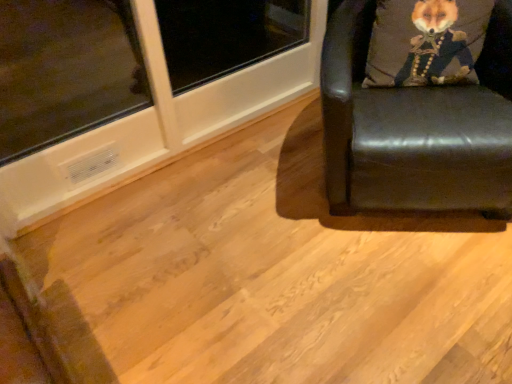
What is the approximate height of velvet fox head at upper right?

It is 13.40 inches.

In order to click on velvet fox head at upper right in this screenshot , I will do `click(426, 42)`.

Image resolution: width=512 pixels, height=384 pixels. What do you see at coordinates (426, 42) in the screenshot? I see `velvet fox head at upper right` at bounding box center [426, 42].

Measure the distance between black leather chair at right and camera.

4.14 feet.

Find the location of a particular element. This screenshot has width=512, height=384. black leather chair at right is located at coordinates (416, 128).

What do you see at coordinates (416, 128) in the screenshot? I see `black leather chair at right` at bounding box center [416, 128].

Measure the distance between point (457, 165) and camera.

Point (457, 165) is 1.33 meters from camera.

Locate an element on the screen. The height and width of the screenshot is (384, 512). velvet fox head at upper right is located at coordinates (426, 42).

Considering the positions of objects black leather chair at right and velvet fox head at upper right in the image provided, who is more to the left, black leather chair at right or velvet fox head at upper right?

From the viewer's perspective, black leather chair at right appears more on the left side.

In the image, is black leather chair at right positioned in front of or behind velvet fox head at upper right?

In the image, black leather chair at right appears in front of velvet fox head at upper right.

Based on the photo, which point is more forward, (x=506, y=94) or (x=442, y=67)?

The point (x=506, y=94) is closer.

From the image's perspective, is black leather chair at right located above or below velvet fox head at upper right?

From the image's perspective, black leather chair at right appears below velvet fox head at upper right.

From a real-world perspective, which object rests below the other?

In real-world perspective, black leather chair at right is lower.

Can you confirm if black leather chair at right is thinner than velvet fox head at upper right?

In fact, black leather chair at right might be wider than velvet fox head at upper right.

Can you confirm if black leather chair at right is taller than velvet fox head at upper right?

Correct, black leather chair at right is much taller as velvet fox head at upper right.

In terms of size, does black leather chair at right appear bigger or smaller than velvet fox head at upper right?

Clearly, black leather chair at right is larger in size than velvet fox head at upper right.

Is black leather chair at right inside the boundaries of velvet fox head at upper right, or outside?

black leather chair at right is not inside velvet fox head at upper right, it's outside.

Is black leather chair at right not near velvet fox head at upper right?

black leather chair at right is near velvet fox head at upper right, not far away.

Could you tell me if black leather chair at right is facing velvet fox head at upper right?

No, black leather chair at right is not turned towards velvet fox head at upper right.

How many degrees apart are the facing directions of black leather chair at right and velvet fox head at upper right?

The angle between the facing direction of black leather chair at right and the facing direction of velvet fox head at upper right is 0.00255 degrees.

How distant is black leather chair at right from velvet fox head at upper right?

They are 7.67 inches apart.

Locate an element on the screen. throw pillow behind the black leather chair at right is located at coordinates (426, 42).

Is velvet fox head at upper right to the left or to the right of black leather chair at right in the image?

In the image, velvet fox head at upper right appears on the right side of black leather chair at right.

Is velvet fox head at upper right closer to camera compared to black leather chair at right?

No, the depth of velvet fox head at upper right is greater than that of black leather chair at right.

Does point (445, 8) appear closer or farther from the camera than point (349, 181)?

Point (445, 8).

From the picture: From the image's perspective, which one is positioned higher, velvet fox head at upper right or black leather chair at right?

From the image's view, velvet fox head at upper right is above.

From a real-world perspective, relative to black leather chair at right, is velvet fox head at upper right vertically above or below?

Clearly, from a real-world perspective, velvet fox head at upper right is above black leather chair at right.

Considering the sizes of objects velvet fox head at upper right and black leather chair at right in the image provided, who is thinner, velvet fox head at upper right or black leather chair at right?

velvet fox head at upper right.

Does velvet fox head at upper right have a lesser height compared to black leather chair at right?

Yes.

Based on the photo, is velvet fox head at upper right bigger or smaller than black leather chair at right?

velvet fox head at upper right is smaller than black leather chair at right.

Is black leather chair at right completely or partially inside velvet fox head at upper right?

No, black leather chair at right is not inside velvet fox head at upper right.

Is velvet fox head at upper right in contact with black leather chair at right?

They are not placed beside each other.

Is velvet fox head at upper right aimed at black leather chair at right?

Yes, velvet fox head at upper right is oriented towards black leather chair at right.

The height and width of the screenshot is (384, 512). What are the coordinates of `chair located underneath the velvet fox head at upper right (from a real-world perspective)` in the screenshot? It's located at (416, 128).

The height and width of the screenshot is (384, 512). I want to click on throw pillow on the right of black leather chair at right, so click(x=426, y=42).

You are a GUI agent. You are given a task and a screenshot of the screen. Output one action in this format:
    pyautogui.click(x=<x>, y=<y>)
    Task: Click on the chair beneath the velvet fox head at upper right (from a real-world perspective)
    
    Given the screenshot: What is the action you would take?
    pyautogui.click(x=416, y=128)